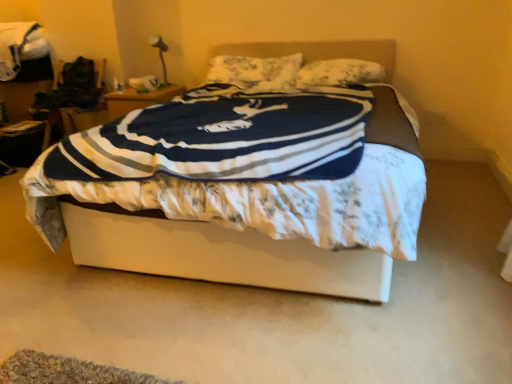
The width and height of the screenshot is (512, 384). What are the coordinates of `matte black blanket at upper left` in the screenshot? It's located at (21, 49).

This screenshot has width=512, height=384. Describe the element at coordinates (160, 53) in the screenshot. I see `metallic silver table lamp at upper left` at that location.

What is the approximate width of metallic silver table lamp at upper left?

metallic silver table lamp at upper left is 9.46 inches in width.

What is the approximate width of white fabric bed at center?

white fabric bed at center is 2.14 meters wide.

Locate an element on the screen. matte black blanket at upper left is located at coordinates (21, 49).

Considering the points (259, 67) and (256, 236), which point is in front, point (259, 67) or point (256, 236)?

The point (256, 236) is closer to the camera.

From the image's perspective, which object appears higher, floral fabric pillow at center, marked as the 1th pillow in a left-to-right arrangement, or white fabric bed at center?

floral fabric pillow at center, marked as the 1th pillow in a left-to-right arrangement, is shown above in the image.

Does floral fabric pillow at center, marked as the 1th pillow in a left-to-right arrangement, have a larger size compared to white fabric bed at center?

Actually, floral fabric pillow at center, marked as the 1th pillow in a left-to-right arrangement, might be smaller than white fabric bed at center.

Considering the points (156, 46) and (41, 30), which point is behind, point (156, 46) or point (41, 30)?

The point (156, 46) is behind.

From a real-world perspective, relative to matte black blanket at upper left, is metallic silver table lamp at upper left vertically above or below?

metallic silver table lamp at upper left is below matte black blanket at upper left.

From the picture: From the image's perspective, is metallic silver table lamp at upper left positioned above or below matte black blanket at upper left?

metallic silver table lamp at upper left is below matte black blanket at upper left.

From their relative heights in the image, would you say metallic silver table lamp at upper left is taller or shorter than matte black blanket at upper left?

→ In the image, metallic silver table lamp at upper left appears to be shorter than matte black blanket at upper left.

Considering the sizes of objects matte black blanket at upper left and metallic silver table lamp at upper left in the image provided, who is bigger, matte black blanket at upper left or metallic silver table lamp at upper left?

Bigger between the two is matte black blanket at upper left.

Is point (5, 34) less distant than point (150, 43)?

That is True.

From the picture: Would you say matte black blanket at upper left is inside or outside metallic silver table lamp at upper left?

matte black blanket at upper left is not inside metallic silver table lamp at upper left, it's outside.

How distant is matte black blanket at upper left from metallic silver table lamp at upper left?

matte black blanket at upper left is 1.00 meters from metallic silver table lamp at upper left.

Looking at their sizes, would you say metallic silver table lamp at upper left is wider or thinner than fluffy white pillow at upper center, placed as the 2th pillow when sorted from left to right?

Clearly, metallic silver table lamp at upper left has less width compared to fluffy white pillow at upper center, placed as the 2th pillow when sorted from left to right.

In the scene shown: Is metallic silver table lamp at upper left not near fluffy white pillow at upper center, placed as the 2th pillow when sorted from left to right?

metallic silver table lamp at upper left is positioned a significant distance from fluffy white pillow at upper center, placed as the 2th pillow when sorted from left to right.

From the image's perspective, which object appears higher, metallic silver table lamp at upper left or fluffy white pillow at upper center, marked as the first pillow in a right-to-left arrangement?

metallic silver table lamp at upper left appears higher in the image.

Who is more distant, metallic silver table lamp at upper left or fluffy white pillow at upper center, marked as the first pillow in a right-to-left arrangement?

metallic silver table lamp at upper left is more distant.

From a real-world perspective, is floral fabric pillow at center, marked as the 1th pillow in a left-to-right arrangement, over matte black blanket at upper left?

No, from a real-world perspective, floral fabric pillow at center, marked as the 1th pillow in a left-to-right arrangement, is not above matte black blanket at upper left.

Considering the sizes of objects floral fabric pillow at center, the 2th pillow in the right-to-left sequence, and matte black blanket at upper left in the image provided, who is shorter, floral fabric pillow at center, the 2th pillow in the right-to-left sequence, or matte black blanket at upper left?

Standing shorter between the two is floral fabric pillow at center, the 2th pillow in the right-to-left sequence.

Choose the correct answer: Is floral fabric pillow at center, marked as the 1th pillow in a left-to-right arrangement, inside matte black blanket at upper left or outside it?

floral fabric pillow at center, marked as the 1th pillow in a left-to-right arrangement, is not inside matte black blanket at upper left, it's outside.

Considering the relative sizes of matte black blanket at upper left and white fabric bed at center in the image provided, is matte black blanket at upper left smaller than white fabric bed at center?

Correct, matte black blanket at upper left occupies less space than white fabric bed at center.

Who is shorter, matte black blanket at upper left or white fabric bed at center?

Standing shorter between the two is matte black blanket at upper left.

Between matte black blanket at upper left and white fabric bed at center, which one appears on the left side from the viewer's perspective?

matte black blanket at upper left.

Based on the photo, in terms of width, does matte black blanket at upper left look wider or thinner when compared to white fabric bed at center?

In the image, matte black blanket at upper left appears to be more narrow than white fabric bed at center.

Relative to floral fabric pillow at center, marked as the 1th pillow in a left-to-right arrangement, is fluffy white pillow at upper center, placed as the 2th pillow when sorted from left to right, in front or behind?

fluffy white pillow at upper center, placed as the 2th pillow when sorted from left to right, is in front of floral fabric pillow at center, marked as the 1th pillow in a left-to-right arrangement.

From the image's perspective, is fluffy white pillow at upper center, placed as the 2th pillow when sorted from left to right, located above floral fabric pillow at center, marked as the 1th pillow in a left-to-right arrangement?

No.

From a real-world perspective, is fluffy white pillow at upper center, marked as the first pillow in a right-to-left arrangement, physically below floral fabric pillow at center, the 2th pillow in the right-to-left sequence?

Yes, from a real-world perspective, fluffy white pillow at upper center, marked as the first pillow in a right-to-left arrangement, is under floral fabric pillow at center, the 2th pillow in the right-to-left sequence.

Is point (382, 75) closer to camera compared to point (279, 77)?

That is True.

Locate an element on the screen. bed located on the right of floral fabric pillow at center, marked as the 1th pillow in a left-to-right arrangement is located at coordinates (212, 252).

What are the coordinates of `blanket above the metallic silver table lamp at upper left (from a real-world perspective)` in the screenshot? It's located at (21, 49).

When comparing their distances from white fabric bed at center, does matte black blanket at upper left or fluffy white pillow at upper center, marked as the first pillow in a right-to-left arrangement, seem closer?

fluffy white pillow at upper center, marked as the first pillow in a right-to-left arrangement, is closer to white fabric bed at center.

When comparing their distances from white fabric bed at center, does floral fabric pillow at center, marked as the 1th pillow in a left-to-right arrangement, or matte black blanket at upper left seem closer?

floral fabric pillow at center, marked as the 1th pillow in a left-to-right arrangement.

Estimate the real-world distances between objects in this image. Which object is further from fluffy white pillow at upper center, marked as the first pillow in a right-to-left arrangement, metallic silver table lamp at upper left or floral fabric pillow at center, the 2th pillow in the right-to-left sequence?

Among the two, metallic silver table lamp at upper left is located further to fluffy white pillow at upper center, marked as the first pillow in a right-to-left arrangement.

Which object lies nearer to the anchor point white fabric bed at center, fluffy white pillow at upper center, marked as the first pillow in a right-to-left arrangement, or matte black blanket at upper left?

fluffy white pillow at upper center, marked as the first pillow in a right-to-left arrangement, is positioned closer to the anchor white fabric bed at center.

Looking at this image, when comparing their distances from white fabric bed at center, does metallic silver table lamp at upper left or matte black blanket at upper left seem closer?

metallic silver table lamp at upper left lies closer to white fabric bed at center than the other object.

When comparing their distances from white fabric bed at center, does fluffy white pillow at upper center, placed as the 2th pillow when sorted from left to right, or floral fabric pillow at center, the 2th pillow in the right-to-left sequence, seem further?

Based on the image, floral fabric pillow at center, the 2th pillow in the right-to-left sequence, appears to be further to white fabric bed at center.

Considering their positions, is white fabric bed at center positioned further to metallic silver table lamp at upper left than floral fabric pillow at center, the 2th pillow in the right-to-left sequence?

Based on the image, white fabric bed at center appears to be further to metallic silver table lamp at upper left.

When comparing their distances from fluffy white pillow at upper center, placed as the 2th pillow when sorted from left to right, does metallic silver table lamp at upper left or white fabric bed at center seem closer?

metallic silver table lamp at upper left is positioned closer to the anchor fluffy white pillow at upper center, placed as the 2th pillow when sorted from left to right.

This screenshot has width=512, height=384. What are the coordinates of `pillow between matte black blanket at upper left and fluffy white pillow at upper center, placed as the 2th pillow when sorted from left to right, in the horizontal direction` in the screenshot? It's located at (255, 71).

Find the location of a particular element. table lamp between matte black blanket at upper left and fluffy white pillow at upper center, marked as the first pillow in a right-to-left arrangement, from left to right is located at coordinates (x=160, y=53).

The height and width of the screenshot is (384, 512). I want to click on pillow between matte black blanket at upper left and white fabric bed at center from left to right, so click(x=255, y=71).

Locate an element on the screen. table lamp between white fabric bed at center and matte black blanket at upper left in the front-back direction is located at coordinates (160, 53).